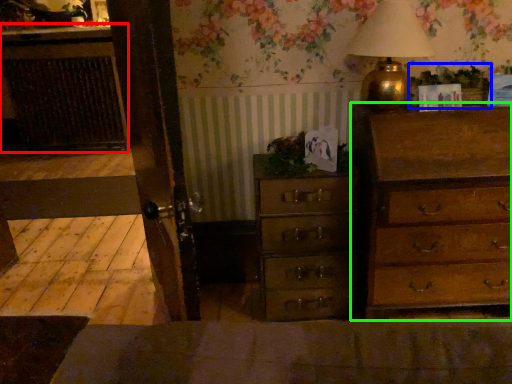
Question: Which object is positioned farthest from cabinetry (highlighted by a red box)? Select from plant (highlighted by a blue box) and chest of drawers (highlighted by a green box).

Choices:
 (A) plant
 (B) chest of drawers

Answer: (A)